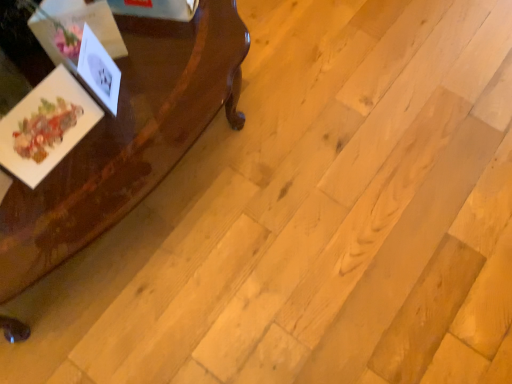
This screenshot has height=384, width=512. What are the coordinates of `vacant area in front of white paper at left, which appears as the 1th postcard when viewed from the right` in the screenshot? It's located at (110, 159).